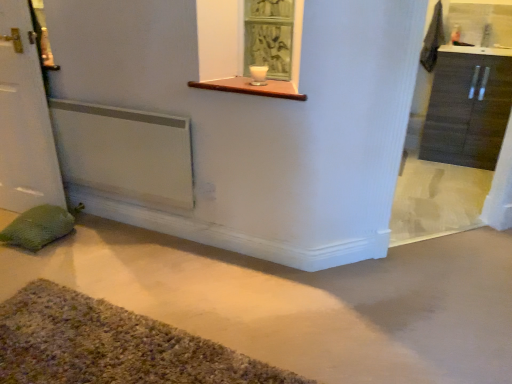
This screenshot has height=384, width=512. What do you see at coordinates (24, 117) in the screenshot?
I see `white matte door at left` at bounding box center [24, 117].

The height and width of the screenshot is (384, 512). Identify the location of dark wood cabinet at right. (467, 110).

In order to click on wooden at upper center in this screenshot , I will do `click(252, 88)`.

The image size is (512, 384). What are the coordinates of `multicolored shaggy bath mat at lower left` in the screenshot? It's located at (111, 345).

Is smooth concrete floor at center turned away from white matte door at left?

smooth concrete floor at center is not turned away from white matte door at left.

From the image's perspective, which one is positioned higher, smooth concrete floor at center or white matte door at left?

white matte door at left appears higher in the image.

Based on the photo, considering the relative sizes of smooth concrete floor at center and white matte door at left in the image provided, is smooth concrete floor at center wider than white matte door at left?

Correct, the width of smooth concrete floor at center exceeds that of white matte door at left.

Is point (69, 245) farther from camera compared to point (9, 118)?

Yes, it is.

Is white ceramic bowl at upper center bigger or smaller than wooden at upper center?

In the image, white ceramic bowl at upper center appears to be smaller than wooden at upper center.

Is point (255, 71) less distant than point (233, 86)?

No.

From a real-world perspective, which object stands above the other?

From a 3D spatial view, white ceramic bowl at upper center is above.

Looking at this image, from the image's perspective, is white ceramic bowl at upper center located above or below wooden at upper center?

From the image's perspective, white ceramic bowl at upper center appears above wooden at upper center.

From a real-world perspective, which object rests below the other?

From a 3D spatial view, dark wood cabinet at right is below.

From the picture: Considering the relative sizes of dark wood cabinet at right and white matte door at left in the image provided, is dark wood cabinet at right taller than white matte door at left?

No.

Can you confirm if dark wood cabinet at right is bigger than white matte door at left?

Yes, dark wood cabinet at right is bigger than white matte door at left.

Considering the points (492, 160) and (34, 73), which point is behind, point (492, 160) or point (34, 73)?

The point (492, 160) is behind.

Is dark wood cabinet at right facing towards wooden at upper center?

No, dark wood cabinet at right is not facing towards wooden at upper center.

Can you confirm if dark wood cabinet at right is thinner than wooden at upper center?

In fact, dark wood cabinet at right might be wider than wooden at upper center.

Is point (490, 56) in front of point (274, 80)?

No.

What's the angular difference between dark wood cabinet at right and wooden at upper center's facing directions?

0.88 degrees separate the facing orientations of dark wood cabinet at right and wooden at upper center.

Is white matte door at left not near multicolored shaggy bath mat at lower left?

Yes, white matte door at left and multicolored shaggy bath mat at lower left are located far from each other.

Where is `bath mat that appears below the white matte door at left (from a real-world perspective)`? bath mat that appears below the white matte door at left (from a real-world perspective) is located at coordinates (111, 345).

Would you say white matte door at left is inside or outside multicolored shaggy bath mat at lower left?

white matte door at left is spatially situated outside multicolored shaggy bath mat at lower left.

From the image's perspective, which object appears higher, white matte door at left or multicolored shaggy bath mat at lower left?

white matte door at left, from the image's perspective.

In the scene shown: Between multicolored shaggy bath mat at lower left and smooth concrete floor at center, which one has larger width?

smooth concrete floor at center.

Looking at this image, is multicolored shaggy bath mat at lower left next to smooth concrete floor at center?

They are not placed beside each other.

Does point (220, 360) lie in front of point (191, 296)?

Yes.

Is multicolored shaggy bath mat at lower left spatially inside smooth concrete floor at center, or outside of it?

The correct answer is: inside.

Is the position of multicolored shaggy bath mat at lower left less distant than that of white matte door at left?

Yes, multicolored shaggy bath mat at lower left is closer to the camera.

In terms of width, does multicolored shaggy bath mat at lower left look wider or thinner when compared to white matte door at left?

multicolored shaggy bath mat at lower left is wider than white matte door at left.

From a real-world perspective, is multicolored shaggy bath mat at lower left located beneath white matte door at left?

Yes, from a real-world perspective, multicolored shaggy bath mat at lower left is beneath white matte door at left.

In the image, there is a smooth concrete floor at center. Where is `door above it (from the image's perspective)`? This screenshot has width=512, height=384. door above it (from the image's perspective) is located at coordinates (24, 117).

You are a GUI agent. You are given a task and a screenshot of the screen. Output one action in this format:
    pyautogui.click(x=<x>, y=<y>)
    Task: Click on the window sill in front of the white ceramic bowl at upper center
    Image resolution: width=512 pixels, height=384 pixels.
    Given the screenshot: What is the action you would take?
    pyautogui.click(x=252, y=88)

Based on their spatial positions, is multicolored shaggy bath mat at lower left or dark wood cabinet at right closer to wooden at upper center?

multicolored shaggy bath mat at lower left lies closer to wooden at upper center than the other object.

Estimate the real-world distances between objects in this image. Which object is further from white ceramic bowl at upper center, smooth concrete floor at center or dark wood cabinet at right?

Among the two, dark wood cabinet at right is located further to white ceramic bowl at upper center.

Estimate the real-world distances between objects in this image. Which object is closer to multicolored shaggy bath mat at lower left, wooden at upper center or smooth concrete floor at center?

smooth concrete floor at center lies closer to multicolored shaggy bath mat at lower left than the other object.

Looking at the image, which one is located closer to white matte door at left, smooth concrete floor at center or multicolored shaggy bath mat at lower left?

smooth concrete floor at center lies closer to white matte door at left than the other object.

When comparing their distances from dark wood cabinet at right, does wooden at upper center or white ceramic bowl at upper center seem further?

wooden at upper center is positioned further to the anchor dark wood cabinet at right.

From the image, which object appears to be nearer to white ceramic bowl at upper center, white matte door at left or wooden at upper center?

wooden at upper center lies closer to white ceramic bowl at upper center than the other object.

Based on their spatial positions, is white ceramic bowl at upper center or dark wood cabinet at right closer to white matte door at left?

white ceramic bowl at upper center is positioned closer to the anchor white matte door at left.

From the image, which object appears to be farther from white matte door at left, white ceramic bowl at upper center or smooth concrete floor at center?

Among the two, white ceramic bowl at upper center is located further to white matte door at left.

You are a GUI agent. You are given a task and a screenshot of the screen. Output one action in this format:
    pyautogui.click(x=<x>, y=<y>)
    Task: Click on the candle holder located between smooth concrete floor at center and dark wood cabinet at right in the left-right direction
    
    Given the screenshot: What is the action you would take?
    pyautogui.click(x=258, y=75)

You are a GUI agent. You are given a task and a screenshot of the screen. Output one action in this format:
    pyautogui.click(x=<x>, y=<y>)
    Task: Click on the window sill between multicolored shaggy bath mat at lower left and dark wood cabinet at right in the horizontal direction
    
    Given the screenshot: What is the action you would take?
    pyautogui.click(x=252, y=88)

Locate an element on the screen. The width and height of the screenshot is (512, 384). concrete located between white matte door at left and white ceramic bowl at upper center in the left-right direction is located at coordinates (305, 301).

Locate an element on the screen. The width and height of the screenshot is (512, 384). window sill located between white matte door at left and dark wood cabinet at right in the left-right direction is located at coordinates (252, 88).